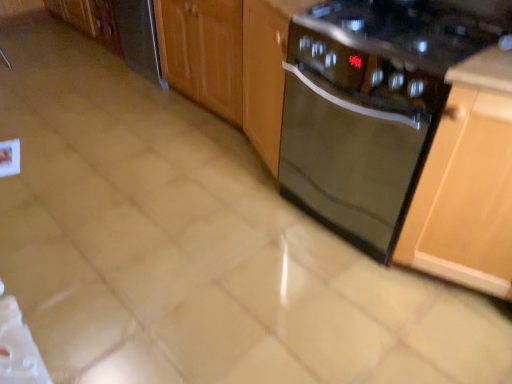
Describe the element at coordinates (467, 183) in the screenshot. Image resolution: width=512 pixels, height=384 pixels. I see `wooden cabinet at right, which is the 1th cabinetry in front-to-back order` at that location.

In order to click on wooden cabinet at right, arranged as the 2th cabinetry when viewed from the left in this screenshot , I will do `click(467, 183)`.

I want to click on black glass gas stove at upper right, so click(413, 28).

The image size is (512, 384). What do you see at coordinates (229, 62) in the screenshot? I see `glossy wood cabinet at center, arranged as the 1th cabinetry when viewed from the back` at bounding box center [229, 62].

What do you see at coordinates (139, 38) in the screenshot? I see `satin stainless steel dishwasher at left` at bounding box center [139, 38].

Identify the location of wooden cabinet at right, which is the 1th cabinetry in front-to-back order. (467, 183).

Identify the location of appliance below the black glass gas stove at upper right (from a real-world perspective). (139, 38).

Is black glass gas stove at upper right beside satin stainless steel dishwasher at left?

No, black glass gas stove at upper right is not with satin stainless steel dishwasher at left.

Looking at this image, considering the sizes of objects black glass gas stove at upper right and satin stainless steel dishwasher at left in the image provided, who is wider, black glass gas stove at upper right or satin stainless steel dishwasher at left?

Wider between the two is black glass gas stove at upper right.

Is black glass gas stove at upper right looking in the opposite direction of satin stainless steel dishwasher at left?

No, black glass gas stove at upper right is not facing the opposite direction of satin stainless steel dishwasher at left.

Considering the points (270, 152) and (488, 286), which point is in front, point (270, 152) or point (488, 286)?

The point (488, 286) is closer.

Is glossy wood cabinet at center, which is counted as the 2th cabinetry, starting from the front, facing towards wooden cabinet at right, placed as the 1th cabinetry when sorted from bottom to top?

No, glossy wood cabinet at center, which is counted as the 2th cabinetry, starting from the front, is not aimed at wooden cabinet at right, placed as the 1th cabinetry when sorted from bottom to top.

I want to click on cabinetry located in front of the glossy wood cabinet at center, the second cabinetry in the bottom-to-top sequence, so click(x=467, y=183).

From a real-world perspective, is glossy wood cabinet at center, arranged as the 1th cabinetry when viewed from the back, located beneath black glass gas stove at upper right?

Yes, from a real-world perspective, glossy wood cabinet at center, arranged as the 1th cabinetry when viewed from the back, is below black glass gas stove at upper right.

From the image's perspective, who appears lower, glossy wood cabinet at center, arranged as the 1th cabinetry when viewed from the back, or black glass gas stove at upper right?

black glass gas stove at upper right.

Based on their positions, is glossy wood cabinet at center, which is counted as the 2th cabinetry, starting from the front, located to the left or right of black glass gas stove at upper right?

glossy wood cabinet at center, which is counted as the 2th cabinetry, starting from the front, is positioned on black glass gas stove at upper right's left side.

Would you say glossy wood cabinet at center, arranged as the 1th cabinetry when viewed from the back, is outside black glass gas stove at upper right?

glossy wood cabinet at center, arranged as the 1th cabinetry when viewed from the back, lies outside black glass gas stove at upper right's area.

Looking at this image, is glossy wood cabinet at center, the first cabinetry from the top, completely or partially outside of satin stainless steel dishwasher at left?

Indeed, glossy wood cabinet at center, the first cabinetry from the top, is completely outside satin stainless steel dishwasher at left.

From their relative heights in the image, would you say glossy wood cabinet at center, the first cabinetry from the top, is taller or shorter than satin stainless steel dishwasher at left?

Clearly, glossy wood cabinet at center, the first cabinetry from the top, is taller compared to satin stainless steel dishwasher at left.

From a real-world perspective, is glossy wood cabinet at center, arranged as the 1th cabinetry when viewed from the back, physically above satin stainless steel dishwasher at left?

Correct, in the physical world, glossy wood cabinet at center, arranged as the 1th cabinetry when viewed from the back, is higher than satin stainless steel dishwasher at left.

Considering the positions of objects glossy wood cabinet at center, which is counted as the 2th cabinetry, starting from the front, and satin stainless steel dishwasher at left in the image provided, who is more to the right, glossy wood cabinet at center, which is counted as the 2th cabinetry, starting from the front, or satin stainless steel dishwasher at left?

Positioned to the right is glossy wood cabinet at center, which is counted as the 2th cabinetry, starting from the front.

Is point (511, 125) more distant than point (201, 72)?

No, (511, 125) is in front of (201, 72).

At what (x,y) coordinates should I click in order to perform the action: click on cabinetry above the glossy wood cabinet at center, placed as the second cabinetry when sorted from right to left (from a real-world perspective). Please return your answer as a coordinate pair (x, y). This screenshot has height=384, width=512. Looking at the image, I should click on (467, 183).

Based on their sizes in the image, would you say wooden cabinet at right, placed as the 1th cabinetry when sorted from bottom to top, is bigger or smaller than glossy wood cabinet at center, the second cabinetry in the bottom-to-top sequence?

In the image, wooden cabinet at right, placed as the 1th cabinetry when sorted from bottom to top, appears to be smaller than glossy wood cabinet at center, the second cabinetry in the bottom-to-top sequence.

Is black glass dishwasher at center surrounding glossy wood cabinet at center, the first cabinetry from the top?

No.

Is black glass dishwasher at center touching glossy wood cabinet at center, arranged as the 1th cabinetry when viewed from the back?

No, black glass dishwasher at center is not in contact with glossy wood cabinet at center, arranged as the 1th cabinetry when viewed from the back.

Can you confirm if black glass dishwasher at center is bigger than glossy wood cabinet at center, the first cabinetry from the top?

No, black glass dishwasher at center is not bigger than glossy wood cabinet at center, the first cabinetry from the top.

Where is `kitchen appliance lying above the wooden cabinet at right, which is the 2th cabinetry from back to front (from the image's perspective)`? This screenshot has width=512, height=384. kitchen appliance lying above the wooden cabinet at right, which is the 2th cabinetry from back to front (from the image's perspective) is located at coordinates (371, 106).

Based on their sizes in the image, would you say black glass dishwasher at center is bigger or smaller than wooden cabinet at right, which is the 2th cabinetry from back to front?

Considering their sizes, black glass dishwasher at center takes up more space than wooden cabinet at right, which is the 2th cabinetry from back to front.

Could you measure the distance between black glass dishwasher at center and wooden cabinet at right, which appears as the 1th cabinetry when viewed from the right?

black glass dishwasher at center and wooden cabinet at right, which appears as the 1th cabinetry when viewed from the right, are 10.48 inches apart.

Is the depth of black glass dishwasher at center less than that of wooden cabinet at right, arranged as the 2th cabinetry when viewed from the left?

No, it is behind wooden cabinet at right, arranged as the 2th cabinetry when viewed from the left.

Locate an element on the screen. The image size is (512, 384). appliance on the left of black glass gas stove at upper right is located at coordinates (139, 38).

Where is `cabinetry above the glossy wood cabinet at center, placed as the second cabinetry when sorted from right to left (from a real-world perspective)`? The width and height of the screenshot is (512, 384). cabinetry above the glossy wood cabinet at center, placed as the second cabinetry when sorted from right to left (from a real-world perspective) is located at coordinates (467, 183).

Based on the photo, based on their spatial positions, is black glass dishwasher at center or black glass gas stove at upper right closer to satin stainless steel dishwasher at left?

black glass dishwasher at center.

Looking at the image, which one is located closer to wooden cabinet at right, which appears as the 1th cabinetry when viewed from the right, satin stainless steel dishwasher at left or black glass gas stove at upper right?

Among the two, black glass gas stove at upper right is located nearer to wooden cabinet at right, which appears as the 1th cabinetry when viewed from the right.

Which object lies nearer to the anchor point black glass gas stove at upper right, wooden cabinet at right, which is the 2th cabinetry from back to front, or black glass dishwasher at center?

The object closer to black glass gas stove at upper right is black glass dishwasher at center.

From the image, which object appears to be farther from black glass gas stove at upper right, satin stainless steel dishwasher at left or black glass dishwasher at center?

Based on the image, satin stainless steel dishwasher at left appears to be further to black glass gas stove at upper right.

Estimate the real-world distances between objects in this image. Which object is further from glossy wood cabinet at center, the second cabinetry in the bottom-to-top sequence, satin stainless steel dishwasher at left or wooden cabinet at right, arranged as the 2th cabinetry when viewed from the left?

wooden cabinet at right, arranged as the 2th cabinetry when viewed from the left, is positioned further to the anchor glossy wood cabinet at center, the second cabinetry in the bottom-to-top sequence.

From the image, which object appears to be farther from black glass dishwasher at center, black glass gas stove at upper right or glossy wood cabinet at center, placed as the second cabinetry when sorted from right to left?

glossy wood cabinet at center, placed as the second cabinetry when sorted from right to left, lies further to black glass dishwasher at center than the other object.

When comparing their distances from satin stainless steel dishwasher at left, does wooden cabinet at right, placed as the 1th cabinetry when sorted from bottom to top, or black glass dishwasher at center seem closer?

The object closer to satin stainless steel dishwasher at left is black glass dishwasher at center.

Based on their spatial positions, is glossy wood cabinet at center, the first cabinetry from the top, or satin stainless steel dishwasher at left further from wooden cabinet at right, which is the 1th cabinetry in front-to-back order?

satin stainless steel dishwasher at left is further to wooden cabinet at right, which is the 1th cabinetry in front-to-back order.

The image size is (512, 384). I want to click on cabinetry between black glass gas stove at upper right and satin stainless steel dishwasher at left from front to back, so click(229, 62).

This screenshot has width=512, height=384. Identify the location of cabinetry located between black glass dishwasher at center and satin stainless steel dishwasher at left in the depth direction. (229, 62).

I want to click on gas stove between wooden cabinet at right, which is the 1th cabinetry in front-to-back order, and satin stainless steel dishwasher at left from front to back, so click(413, 28).

What are the coordinates of `kitchen appliance between black glass gas stove at upper right and wooden cabinet at right, the second cabinetry positioned from the top, vertically` in the screenshot? It's located at (371, 106).